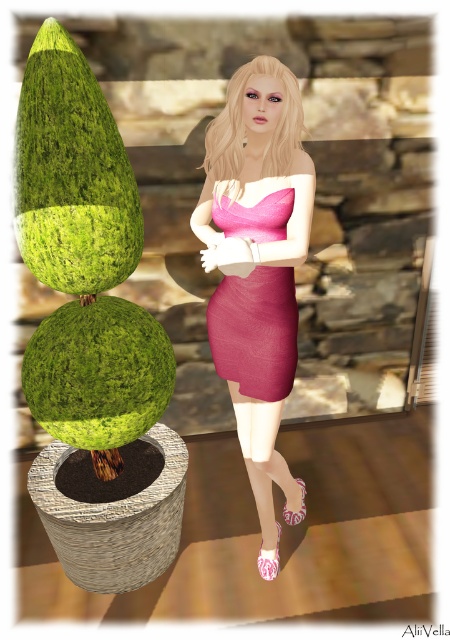
Between pink satin dress at center and pink matte dress at center, which one is positioned higher?

Positioned higher is pink matte dress at center.

Can you confirm if pink satin dress at center is smaller than pink matte dress at center?

No.

What do you see at coordinates (257, 269) in the screenshot? The width and height of the screenshot is (450, 640). I see `pink satin dress at center` at bounding box center [257, 269].

Where is `pink satin dress at center`? pink satin dress at center is located at coordinates (257, 269).